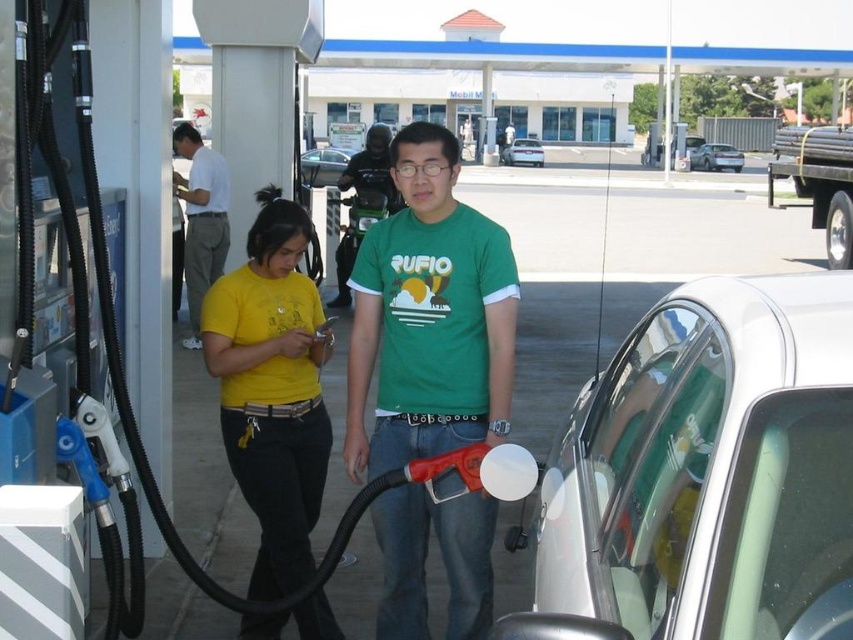
What is the color of the shirt worn by the person located at the coordinates point (x=271, y=388) in the image?

The point (x=271, y=388) marks the yellow matte shirt at center, so the color is yellow.

You are a photographer trying to capture a wide shot of the scene at the gas station. You need to ensure that both the white cotton shirt at left and the light blue metallic sedan at center are fully visible in the frame. Based on their sizes, which object might require you to adjust your camera angle to include it properly?

The light blue metallic sedan at center is wider than the white cotton shirt at left, so you might need to adjust your camera angle to ensure the sedan is fully captured in the frame.

You are a customer at the gas station and want to reach the silver metallic sedan at center to retrieve your keys. However, there is a person in the yellow matte shirt at center blocking your path. Based on their positions, can you walk around them to reach the car?

The yellow matte shirt at center is to the left of the silver metallic sedan at center. Since the person in the yellow matte shirt is on the left side of the car, you can walk around them on the right side of the silver metallic sedan at center to reach the car.